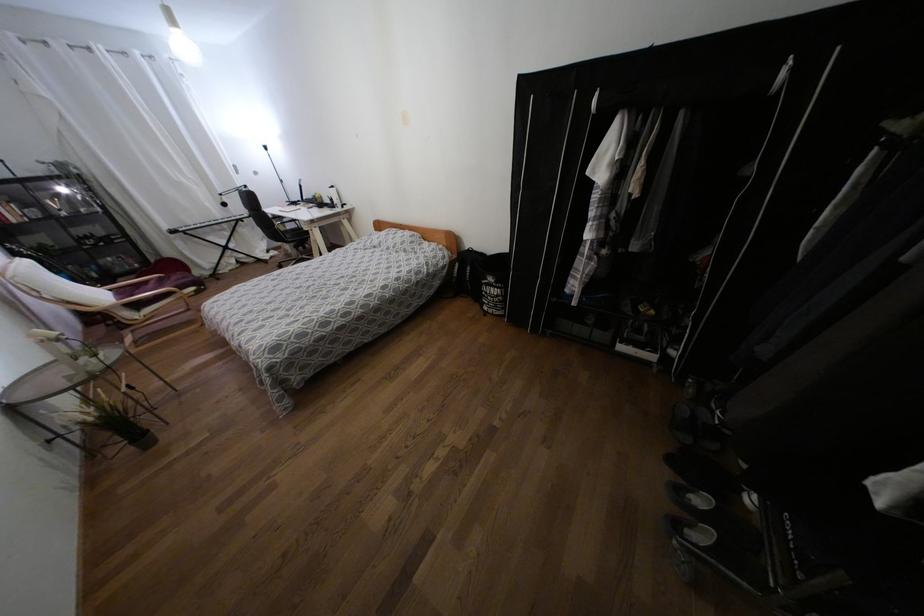
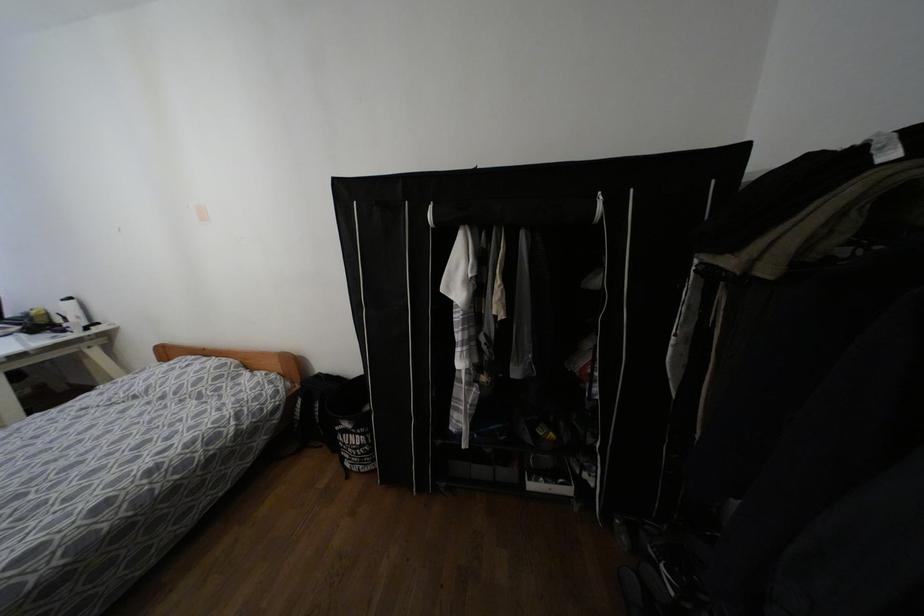
Based on the continuous images, in which direction is the camera rotating?

The camera's rotation is toward right-up.